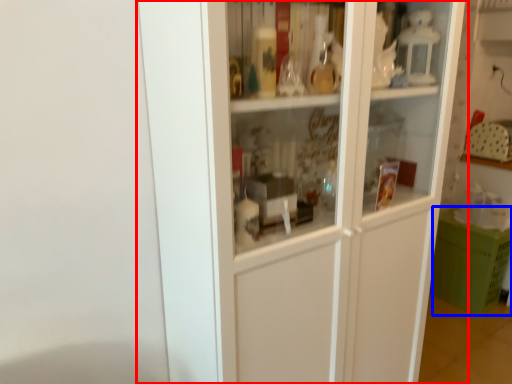
Question: Which object appears closest to the camera in this image, cupboard (highlighted by a red box) or cabinetry (highlighted by a blue box)?

Choices:
 (A) cupboard
 (B) cabinetry

Answer: (A)